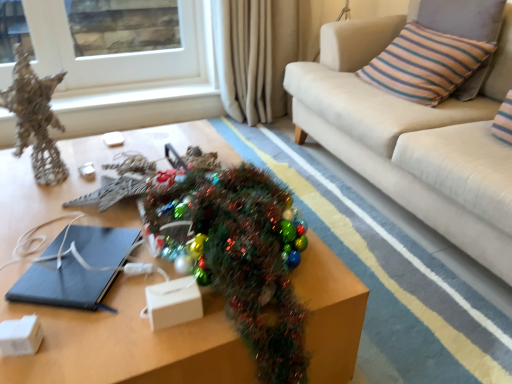
At what (x,y) coordinates should I click in order to perform the action: click on free space in front of matte black notebook at center. Please return your answer as a coordinate pair (x, y). The image size is (512, 384). Looking at the image, I should click on (73, 339).